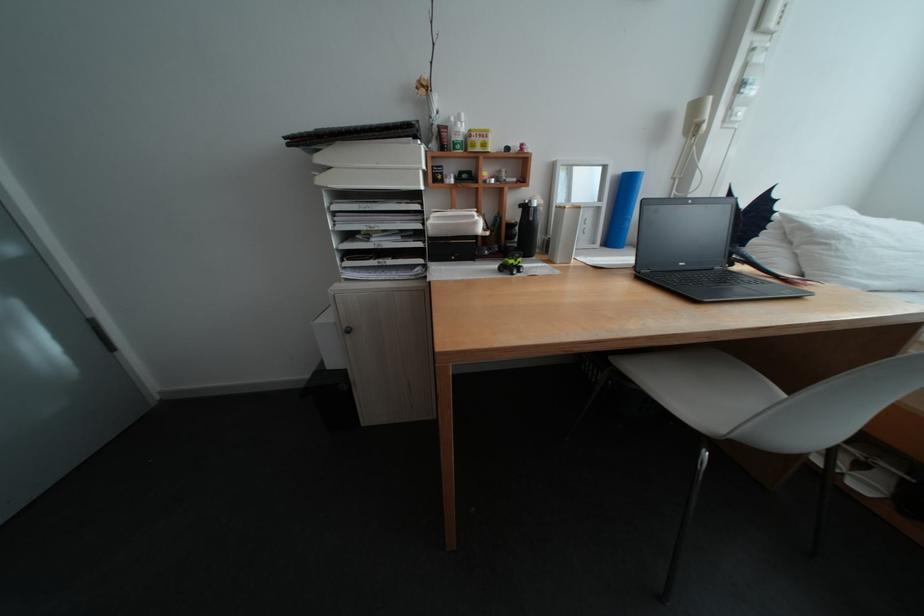
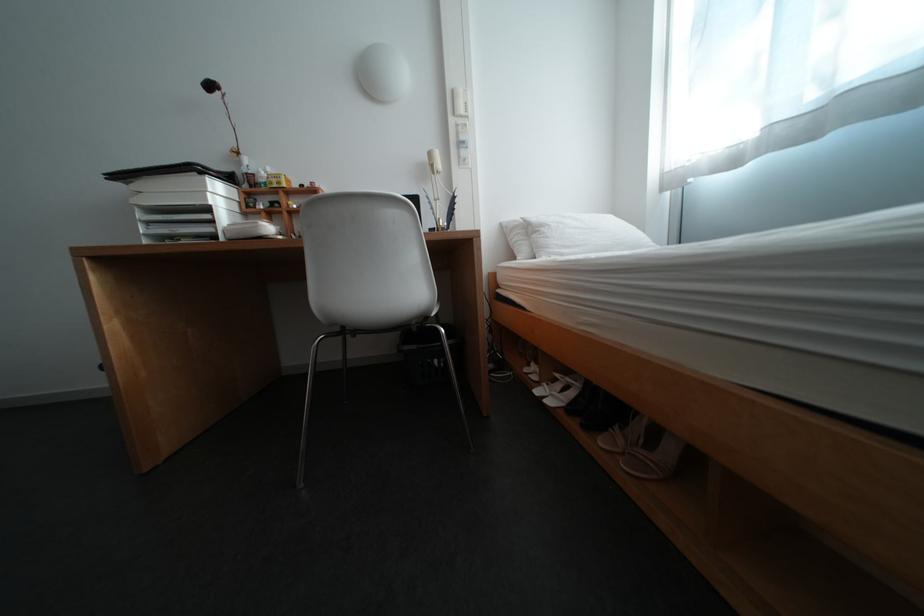
Where in the second image is the point corresponding to (485,217) from the first image?

(270, 224)